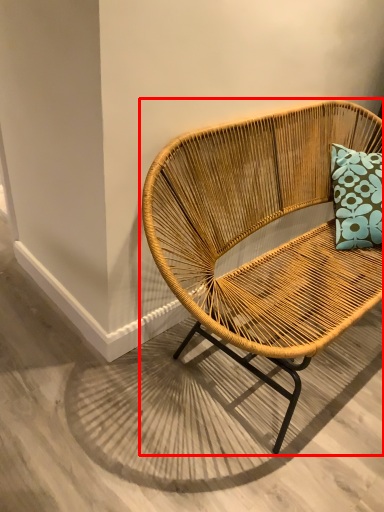
Question: Observing the image, what is the correct spatial positioning of chair (annotated by the red box) in reference to concrete?

Choices:
 (A) right
 (B) left

Answer: (A)